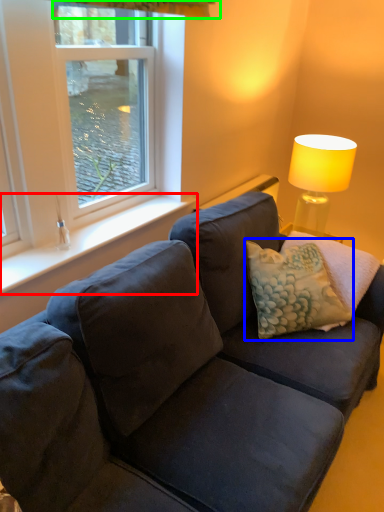
Question: Which object is the farthest from window sill (highlighted by a red box)? Choose among these: pillow (highlighted by a blue box) or curtain (highlighted by a green box).

Choices:
 (A) pillow
 (B) curtain

Answer: (B)